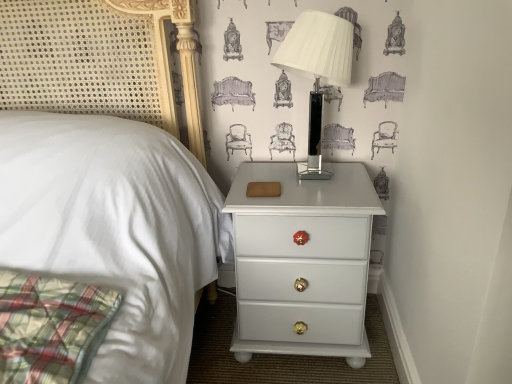
Identify the location of vacant space situated above white glossy nightstand at lower right (from a real-world perspective). 307,181.